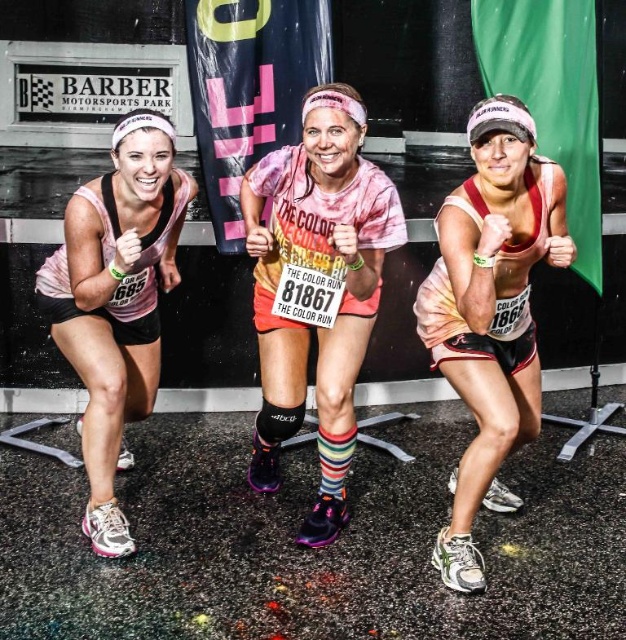
You are a photographer standing at point (344,384). You need to take a photo of three runners who are 8.00 feet apart from each other. Where should you position yourself to capture all three runners in the frame?

The photographer should position themselves at point (344,384) to capture all three runners since they are 8.00 feet apart, which is within the camera frame.